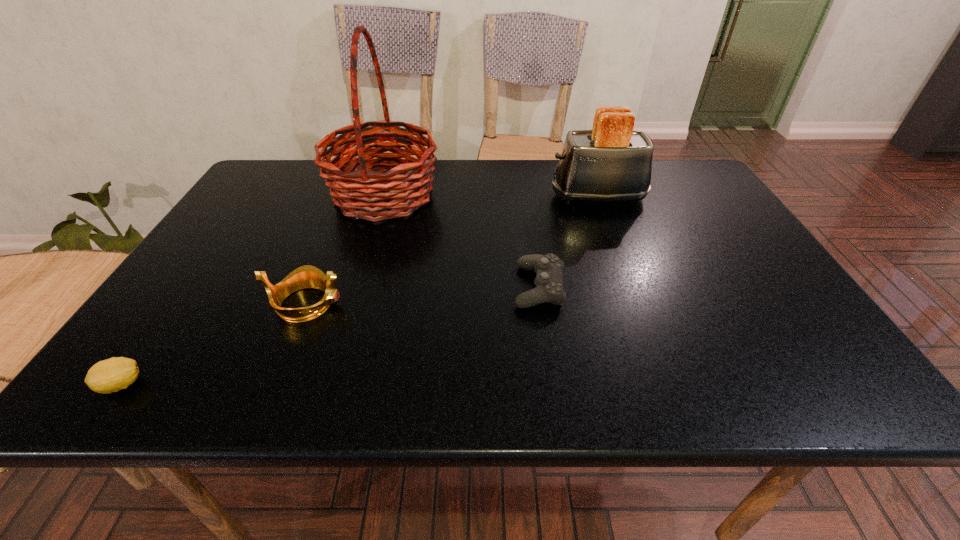
The image size is (960, 540). Identify the location of vacant area situated on the side of the rightmost object with the control lever. (509, 197).

At what (x,y) coordinates should I click in order to perform the action: click on vacant space located at the front emblem of the third tallest object. Please return your answer as a coordinate pair (x, y). This screenshot has width=960, height=540. Looking at the image, I should click on 427,303.

Where is `free space located 0.310m on the left of the control`? Image resolution: width=960 pixels, height=540 pixels. free space located 0.310m on the left of the control is located at coordinates (376, 287).

What are the coordinates of `free spot located 0.370m at the stem end of the lemon` in the screenshot? It's located at (345, 384).

You are a GUI agent. You are given a task and a screenshot of the screen. Output one action in this format:
    pyautogui.click(x=<x>, y=<y>)
    Task: Click on the basket situated at the far edge
    Image resolution: width=960 pixels, height=540 pixels.
    Given the screenshot: What is the action you would take?
    pyautogui.click(x=399, y=185)

The image size is (960, 540). I want to click on toaster that is positioned at the far edge, so click(612, 162).

Identify the location of object located at the near edge. (111, 375).

This screenshot has width=960, height=540. I want to click on object that is at the left edge, so click(111, 375).

Locate an element on the screen. This screenshot has width=960, height=540. object situated at the near left corner is located at coordinates click(x=111, y=375).

This screenshot has height=540, width=960. What are the coordinates of `free spot at the far edge of the desktop` in the screenshot? It's located at (495, 170).